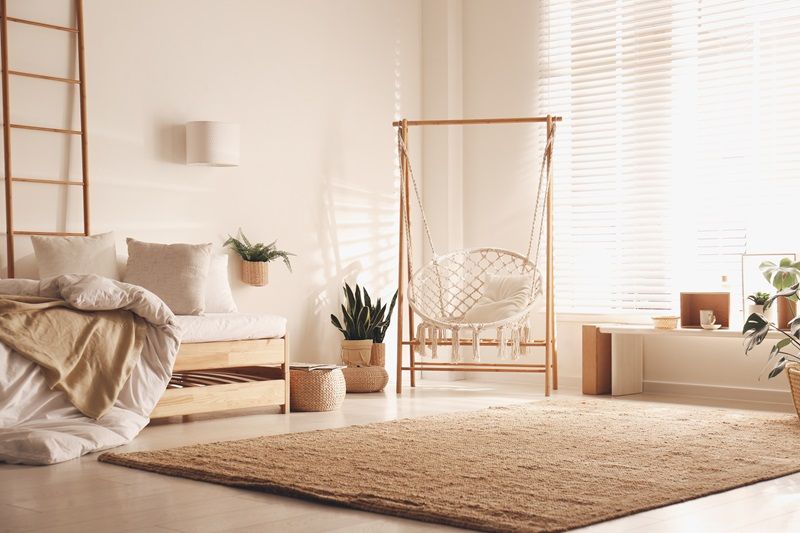
Locate an element on the screen. swing chair is located at coordinates (454, 298).